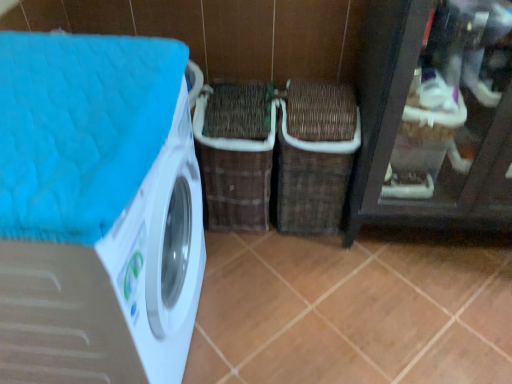
The width and height of the screenshot is (512, 384). I want to click on vacant area on top of brown matte tile at center (from a real-world perspective), so click(376, 293).